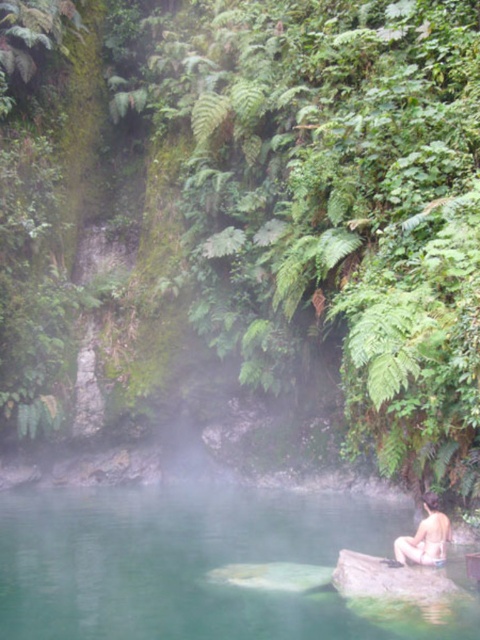
You are a photographer planning to take a portrait of the nude human at lower right while ensuring the green smooth water at lower center remains visible in the background. Based on their relative heights, which subject should you focus on to ensure proper framing?

The green smooth water at lower center is much taller than the nude human at lower right. To ensure proper framing, focus on the nude human at lower right as the main subject while keeping the green smooth water at lower center in the background for context.

You are a photographer standing at the edge of the hot spring. You want to capture a photo of the nude human at lower right and the green smooth water at lower center. Based on their sizes, which one would appear larger in the photo?

The green smooth water at lower center might appear larger in the photo than the nude human at lower right because it is wider.

You are a photographer planning to capture the nude human at lower right and the green smooth water at lower center in a single frame. Based on their sizes, which object should you focus on first to ensure both are in the frame?

The green smooth water at lower center is larger in size than the nude human at lower right, so you should focus on the green smooth water at lower center first to ensure both fit within the frame.